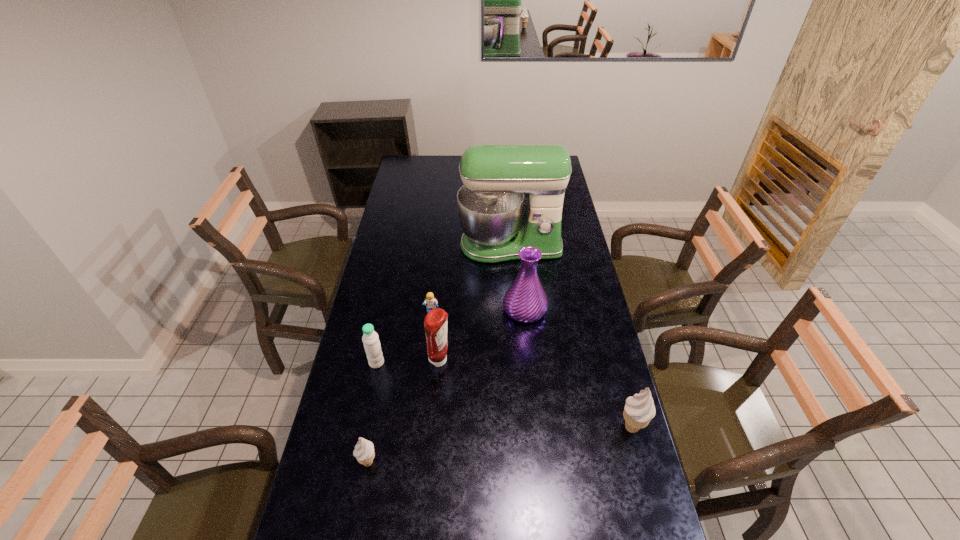
Where is `vacant space located on the front of the water bottle`? This screenshot has height=540, width=960. vacant space located on the front of the water bottle is located at coordinates (353, 477).

Where is `icecream present at the left edge`? icecream present at the left edge is located at coordinates pyautogui.click(x=364, y=452).

Find the location of a particular element. This screenshot has width=960, height=540. water bottle that is at the left edge is located at coordinates (370, 338).

Where is `icecream that is at the right edge`? This screenshot has height=540, width=960. icecream that is at the right edge is located at coordinates (639, 410).

Where is `mixer positioned at the right edge`? This screenshot has width=960, height=540. mixer positioned at the right edge is located at coordinates (490, 204).

You are a GUI agent. You are given a task and a screenshot of the screen. Output one action in this format:
    pyautogui.click(x=<x>, y=<y>)
    Task: Click on the vacant space at the near edge
    
    Given the screenshot: What is the action you would take?
    pyautogui.click(x=516, y=502)

Locate an element on the screen. Image resolution: width=960 pixels, height=540 pixels. free space at the left edge of the desktop is located at coordinates (419, 211).

Locate an element on the screen. vacant space at the right edge is located at coordinates (564, 229).

What are the coordinates of `vacant space at the far left corner of the desktop` in the screenshot? It's located at (410, 175).

In order to click on free space at the near right corner of the desktop in this screenshot , I will do `click(609, 500)`.